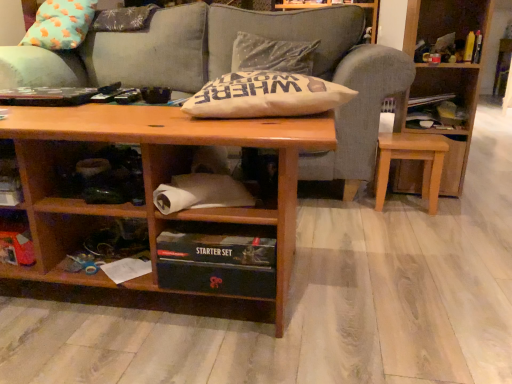
The width and height of the screenshot is (512, 384). What do you see at coordinates (218, 258) in the screenshot? I see `black cardboard box at lower center, arranged as the 2th cabinet when viewed from the top` at bounding box center [218, 258].

You are a GUI agent. You are given a task and a screenshot of the screen. Output one action in this format:
    pyautogui.click(x=<x>, y=<y>)
    Task: Click on the matte cardboard paper at lower center, arranged as the 2th cabinet when ordered from the bottom
    The width and height of the screenshot is (512, 384).
    Given the screenshot: What is the action you would take?
    pyautogui.click(x=203, y=185)

What do you see at coordinates (229, 67) in the screenshot? I see `gray fabric couch at center` at bounding box center [229, 67].

Find the location of a particular element. The height and width of the screenshot is (384, 512). white cotton pillow at center is located at coordinates (266, 96).

Is wooden bookcase at right turned away from matte cardboard paper at lower center, arranged as the 2th cabinet when ordered from the bottom?

No, wooden bookcase at right is not facing away from matte cardboard paper at lower center, arranged as the 2th cabinet when ordered from the bottom.

Can you confirm if wooden bookcase at right is smaller than matte cardboard paper at lower center, the 1th cabinet from the top?

Actually, wooden bookcase at right might be larger than matte cardboard paper at lower center, the 1th cabinet from the top.

Is wooden bookcase at right directly adjacent to matte cardboard paper at lower center, arranged as the 2th cabinet when ordered from the bottom?

No, wooden bookcase at right is not with matte cardboard paper at lower center, arranged as the 2th cabinet when ordered from the bottom.

Identify the location of cabinet that is the 1st one below the wooden bookcase at right (from a real-world perspective). The width and height of the screenshot is (512, 384). (203, 185).

Is wooden bookcase at right positioned beyond the bounds of wooden box at lower left?

Indeed, wooden bookcase at right is completely outside wooden box at lower left.

Consider the image. Considering the relative sizes of wooden bookcase at right and wooden box at lower left in the image provided, is wooden bookcase at right wider than wooden box at lower left?

Yes.

In terms of height, does wooden bookcase at right look taller or shorter compared to wooden box at lower left?

In the image, wooden bookcase at right appears to be taller than wooden box at lower left.

Is point (445, 25) less distant than point (13, 218)?

No.

Does matte cardboard paper at lower center, arranged as the 2th cabinet when ordered from the bottom, have a larger size compared to light brown wooden stool at lower right?

Actually, matte cardboard paper at lower center, arranged as the 2th cabinet when ordered from the bottom, might be smaller than light brown wooden stool at lower right.

Is matte cardboard paper at lower center, arranged as the 2th cabinet when ordered from the bottom, aimed at light brown wooden stool at lower right?

No.

Is matte cardboard paper at lower center, arranged as the 2th cabinet when ordered from the bottom, taller or shorter than light brown wooden stool at lower right?

Considering their sizes, matte cardboard paper at lower center, arranged as the 2th cabinet when ordered from the bottom, has less height than light brown wooden stool at lower right.

Considering their positions, is gray fabric couch at center located in front of or behind black cardboard box at lower center, arranged as the 2th cabinet when viewed from the top?

gray fabric couch at center is behind black cardboard box at lower center, arranged as the 2th cabinet when viewed from the top.

From a real-world perspective, is gray fabric couch at center over black cardboard box at lower center, arranged as the 1th cabinet when ordered from the bottom?

Yes.

Is gray fabric couch at center shorter than black cardboard box at lower center, arranged as the 2th cabinet when viewed from the top?

No.

How different are the orientations of gray fabric couch at center and black cardboard box at lower center, arranged as the 2th cabinet when viewed from the top, in degrees?

3 degrees separate the facing orientations of gray fabric couch at center and black cardboard box at lower center, arranged as the 2th cabinet when viewed from the top.

Is wooden bookcase at right next to gray fabric couch at center and touching it?

No, wooden bookcase at right is not next to gray fabric couch at center.

From the image's perspective, is wooden bookcase at right located beneath gray fabric couch at center?

Yes, from the image's perspective, wooden bookcase at right is beneath gray fabric couch at center.

From a real-world perspective, is wooden bookcase at right physically above gray fabric couch at center?

No, from a real-world perspective, wooden bookcase at right is not over gray fabric couch at center

Does black cardboard box at lower center, arranged as the 2th cabinet when viewed from the top, turn towards matte cardboard paper at lower center, the 1th cabinet from the top?

No, black cardboard box at lower center, arranged as the 2th cabinet when viewed from the top, does not turn towards matte cardboard paper at lower center, the 1th cabinet from the top.

Is black cardboard box at lower center, arranged as the 1th cabinet when ordered from the bottom, completely or partially outside of matte cardboard paper at lower center, arranged as the 2th cabinet when ordered from the bottom?

Yes.

Is black cardboard box at lower center, arranged as the 2th cabinet when viewed from the top, in front of or behind matte cardboard paper at lower center, the 1th cabinet from the top, in the image?

Visually, black cardboard box at lower center, arranged as the 2th cabinet when viewed from the top, is located behind matte cardboard paper at lower center, the 1th cabinet from the top.

From the image's perspective, is black cardboard box at lower center, arranged as the 2th cabinet when viewed from the top, located beneath matte cardboard paper at lower center, arranged as the 2th cabinet when ordered from the bottom?

Yes.

From the image's perspective, is black cardboard box at lower center, arranged as the 1th cabinet when ordered from the bottom, above gray fabric couch at center?

Incorrect, from the image's perspective, black cardboard box at lower center, arranged as the 1th cabinet when ordered from the bottom, is lower than gray fabric couch at center.

Between black cardboard box at lower center, arranged as the 2th cabinet when viewed from the top, and gray fabric couch at center, which one has smaller width?

With smaller width is black cardboard box at lower center, arranged as the 2th cabinet when viewed from the top.

Does point (162, 236) lie in front of point (279, 17)?

Yes, it is in front of point (279, 17).

Considering the relative positions of black cardboard box at lower center, arranged as the 2th cabinet when viewed from the top, and gray fabric couch at center in the image provided, is black cardboard box at lower center, arranged as the 2th cabinet when viewed from the top, in front of gray fabric couch at center?

That is True.

Locate an element on the screen. cabinet that is the 1st one when counting downward from the wooden bookcase at right (from the image's perspective) is located at coordinates (203, 185).

Identify the location of shelf in front of the wooden bookcase at right. (16, 238).

Which object lies further to the anchor point gray fabric couch at center, wooden box at lower left or matte cardboard paper at lower center, the 1th cabinet from the top?

wooden box at lower left is positioned further to the anchor gray fabric couch at center.

Considering their positions, is wooden bookcase at right positioned further to white cotton pillow at center than gray fabric couch at center?

Result: gray fabric couch at center lies further to white cotton pillow at center than the other object.

From the image, which object appears to be nearer to light brown wooden stool at lower right, gray fabric couch at center or white cotton pillow at center?

white cotton pillow at center.

Looking at the image, which one is located closer to wooden bookcase at right, light brown wooden stool at lower right or gray fabric couch at center?

light brown wooden stool at lower right.

Considering their positions, is white cotton pillow at center positioned further to wooden bookcase at right than gray fabric couch at center?

white cotton pillow at center lies further to wooden bookcase at right than the other object.

Estimate the real-world distances between objects in this image. Which object is closer to gray fabric couch at center, light brown wooden stool at lower right or white cotton pillow at center?

Among the two, light brown wooden stool at lower right is located nearer to gray fabric couch at center.

Estimate the real-world distances between objects in this image. Which object is closer to black cardboard box at lower center, arranged as the 2th cabinet when viewed from the top, gray fabric couch at center or wooden box at lower left?

wooden box at lower left.

When comparing their distances from matte cardboard paper at lower center, the 1th cabinet from the top, does gray fabric couch at center or wooden box at lower left seem further?

Among the two, gray fabric couch at center is located further to matte cardboard paper at lower center, the 1th cabinet from the top.

The image size is (512, 384). Find the location of `cabinet between white cotton pillow at center and black cardboard box at lower center, arranged as the 1th cabinet when ordered from the bottom, in the vertical direction`. cabinet between white cotton pillow at center and black cardboard box at lower center, arranged as the 1th cabinet when ordered from the bottom, in the vertical direction is located at coordinates (203, 185).

Find the location of a particular element. The height and width of the screenshot is (384, 512). shelf between gray fabric couch at center and black cardboard box at lower center, arranged as the 2th cabinet when viewed from the top, from top to bottom is located at coordinates pos(16,238).

At what (x,y) coordinates should I click in order to perform the action: click on pillow between wooden box at lower left and light brown wooden stool at lower right in the horizontal direction. Please return your answer as a coordinate pair (x, y). This screenshot has width=512, height=384. Looking at the image, I should click on click(x=266, y=96).

Where is `stool between white cotton pillow at center and wooden bookcase at right in the horizontal direction`? The height and width of the screenshot is (384, 512). stool between white cotton pillow at center and wooden bookcase at right in the horizontal direction is located at coordinates (411, 159).